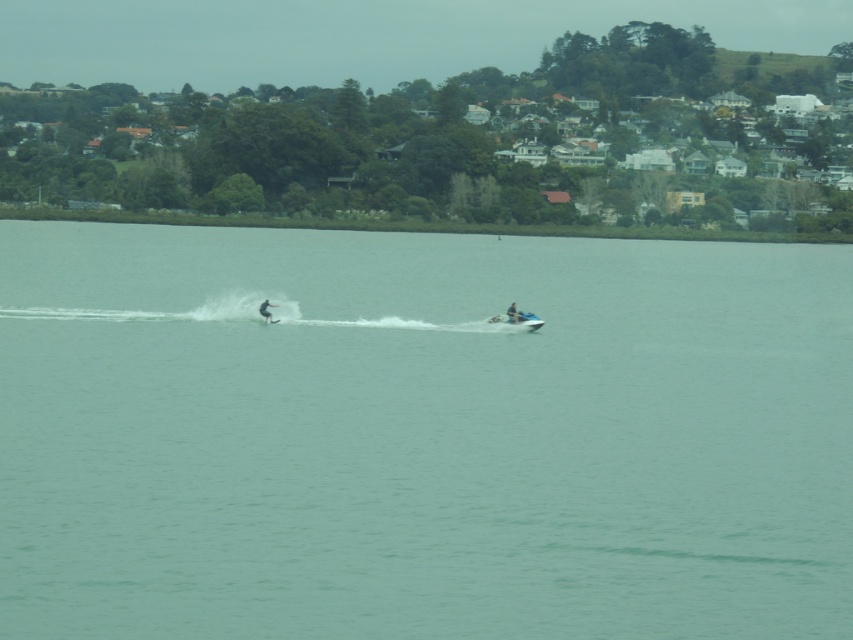
You are a photographer planning to capture the reflection of the white plastic boat at center and the white matte surfboard at center on the calm turquoise water. Which object will have a clearer reflection? Please explain your reasoning based on their positions.

The white matte surfboard at center is behind the white plastic boat at center, so the white plastic boat at center will have a clearer reflection because it is closer to the water surface where the reflection forms.

You are a lifeguard on duty and need to assess the distance between the clear water at center and the white plastic boat at center. Based on the scene, can you determine if the distance is more than 20 meters?

The clear water at center is 20.99 meters from the white plastic boat at center, so the distance is more than 20 meters.